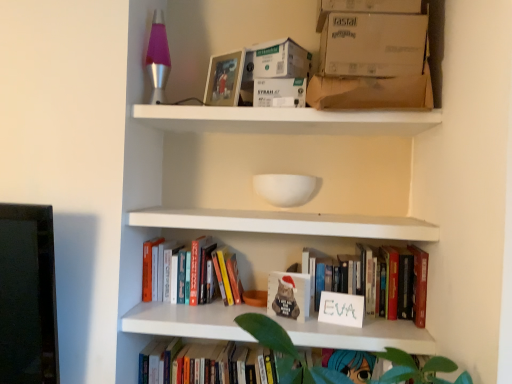
Question: Is white cardboard box at upper center positioned behind white matte shelf at upper center?

Choices:
 (A) yes
 (B) no

Answer: (A)

Question: From the image's perspective, is white cardboard box at upper center beneath white matte shelf at upper center?

Choices:
 (A) no
 (B) yes

Answer: (A)

Question: From a real-world perspective, is white cardboard box at upper center on top of white matte shelf at upper center?

Choices:
 (A) no
 (B) yes

Answer: (B)

Question: Is white cardboard box at upper center shorter than white matte shelf at upper center?

Choices:
 (A) yes
 (B) no

Answer: (B)

Question: Is there a large distance between white cardboard box at upper center and white matte shelf at upper center?

Choices:
 (A) yes
 (B) no

Answer: (B)

Question: Is white cardboard box at upper center in front of or behind matte white book at center in the image?

Choices:
 (A) front
 (B) behind

Answer: (A)

Question: From their relative heights in the image, would you say white cardboard box at upper center is taller or shorter than matte white book at center?

Choices:
 (A) short
 (B) tall

Answer: (A)

Question: From the image's perspective, is white cardboard box at upper center located above or below matte white book at center?

Choices:
 (A) below
 (B) above

Answer: (B)

Question: From a real-world perspective, is white cardboard box at upper center above or below matte white book at center?

Choices:
 (A) above
 (B) below

Answer: (A)

Question: Would you say matte plastic picture frame at upper center is to the left or to the right of white matte sign at center, which is counted as the 2th book, starting from the top, in the picture?

Choices:
 (A) right
 (B) left

Answer: (B)

Question: Is matte plastic picture frame at upper center wider or thinner than white matte sign at center, which is counted as the 2th book, starting from the top?

Choices:
 (A) wide
 (B) thin

Answer: (B)

Question: From a real-world perspective, relative to white matte sign at center, which is counted as the 2th book, starting from the top, is matte plastic picture frame at upper center vertically above or below?

Choices:
 (A) below
 (B) above

Answer: (B)

Question: In terms of size, does matte plastic picture frame at upper center appear bigger or smaller than white matte sign at center, marked as the 2th book in a bottom-to-top arrangement?

Choices:
 (A) small
 (B) big

Answer: (A)

Question: Is white cardboard box at upper right, the second cardboard box positioned from the bottom, bigger or smaller than hardcover book at lower center, which is the 3th book in top-to-bottom order?

Choices:
 (A) big
 (B) small

Answer: (B)

Question: In the image, is white cardboard box at upper right, the 2th cardboard box in the top-to-bottom sequence, on the left side or the right side of hardcover book at lower center, marked as the 1th book in a bottom-to-top arrangement?

Choices:
 (A) right
 (B) left

Answer: (A)